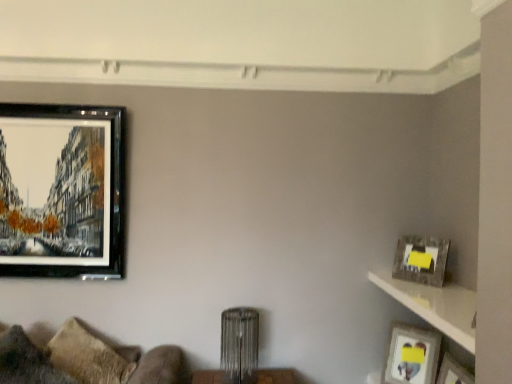
Question: Considering the relative sizes of matte silver picture frame at right, the 2th picture frame from the left, and matte black picture frame at upper left, placed as the 3th picture frame when sorted from bottom to top, in the image provided, is matte silver picture frame at right, the 2th picture frame from the left, taller than matte black picture frame at upper left, placed as the 3th picture frame when sorted from bottom to top,?

Choices:
 (A) yes
 (B) no

Answer: (B)

Question: From a real-world perspective, is matte silver picture frame at right, the first picture frame when ordered from bottom to top, physically below matte black picture frame at upper left, acting as the 3th picture frame starting from the right?

Choices:
 (A) no
 (B) yes

Answer: (B)

Question: Could you tell me if matte silver picture frame at right, the 3th picture frame in the top-to-bottom sequence, is turned towards matte black picture frame at upper left, placed as the 3th picture frame when sorted from bottom to top?

Choices:
 (A) no
 (B) yes

Answer: (A)

Question: Is matte silver picture frame at right, the first picture frame when ordered from bottom to top, outside of matte black picture frame at upper left, the 1th picture frame viewed from the left?

Choices:
 (A) yes
 (B) no

Answer: (A)

Question: From a real-world perspective, is matte silver picture frame at right, the 3th picture frame in the top-to-bottom sequence, positioned over matte black picture frame at upper left, placed as the 3th picture frame when sorted from bottom to top, based on gravity?

Choices:
 (A) yes
 (B) no

Answer: (B)

Question: Does matte silver picture frame at right, the first picture frame when ordered from bottom to top, have a lesser width compared to matte black picture frame at upper left, acting as the 3th picture frame starting from the right?

Choices:
 (A) no
 (B) yes

Answer: (A)

Question: From a real-world perspective, is matte gray shelf at right physically above textured brown pillow at lower left?

Choices:
 (A) yes
 (B) no

Answer: (A)

Question: Is matte gray shelf at right at the right side of textured brown pillow at lower left?

Choices:
 (A) yes
 (B) no

Answer: (A)

Question: From the image's perspective, does matte gray shelf at right appear higher than textured brown pillow at lower left?

Choices:
 (A) yes
 (B) no

Answer: (A)

Question: From the image's perspective, is matte gray shelf at right beneath textured brown pillow at lower left?

Choices:
 (A) yes
 (B) no

Answer: (B)

Question: Does matte gray shelf at right have a greater height compared to textured brown pillow at lower left?

Choices:
 (A) no
 (B) yes

Answer: (A)

Question: Is matte gray shelf at right closer to camera compared to textured brown pillow at lower left?

Choices:
 (A) no
 (B) yes

Answer: (B)

Question: From a real-world perspective, is matte gray picture frame at upper right, which is the 1th picture frame in right-to-left order, positioned under matte black picture frame at upper left, which appears as the 1th picture frame when viewed from the top, based on gravity?

Choices:
 (A) no
 (B) yes

Answer: (B)